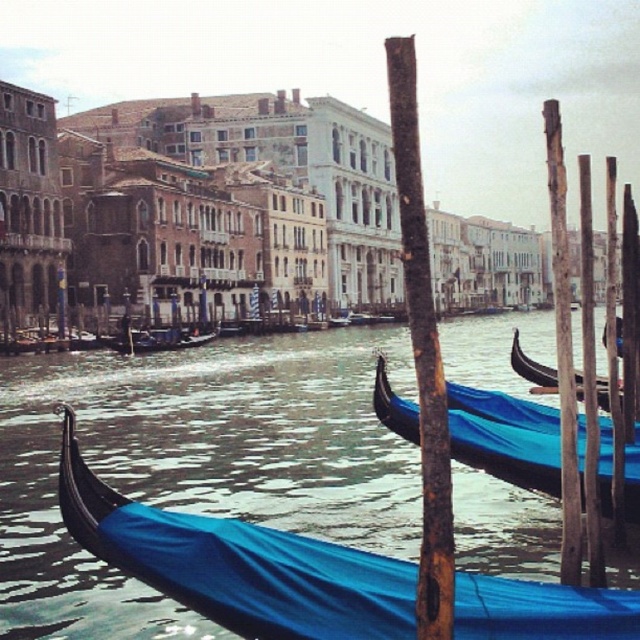
You are standing at the edge of the canal in Venice and see two points marked on the water surface. The first point is at coordinates point (518, 369) and the second is at point (124, 332). Which point is closer to your current position?

Point (518, 369) is closer to the camera than point (124, 332), so the first point is closer to your current position.

You are standing on the bridge overlooking the canal and want to take a photo. There are two points of interest marked in the scene. The first point is at coordinates point (x=241, y=602) and the second is at point (x=596, y=387). Which point is closer to you when you are on the bridge?

Point (x=241, y=602) is closer to the camera than point (x=596, y=387), so the first point is closer to you when you are on the bridge.

You are a tour guide leading a group along the canal. You need to move a 10 meter long wooden plank between the blue polished wood gondola at center and the blue fabric gondola at center. Is there enough space between them to place the plank without bending it?

The blue polished wood gondola at center and blue fabric gondola at center are 9.97 meters apart. Since the plank is 10 meters long, there isn not enough space to place it straight between them without bending it.